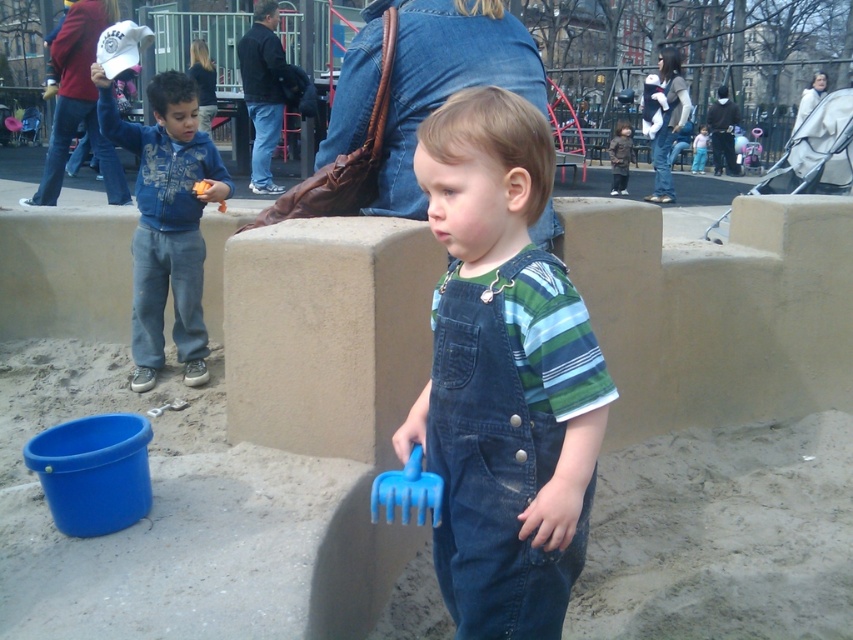
Question: Does denim overalls at center have a greater width compared to blue fleece jacket at left?

Choices:
 (A) yes
 (B) no

Answer: (B)

Question: Which of the following is the closest to the observer?

Choices:
 (A) (177, 282)
 (B) (534, 435)

Answer: (B)

Question: Can you confirm if denim overalls at center is smaller than blue fleece jacket at left?

Choices:
 (A) yes
 (B) no

Answer: (A)

Question: Among these objects, which one is nearest to the camera?

Choices:
 (A) denim overalls at center
 (B) blue fleece jacket at left

Answer: (A)

Question: Can you confirm if denim overalls at center is positioned to the left of blue fleece jacket at left?

Choices:
 (A) yes
 (B) no

Answer: (B)